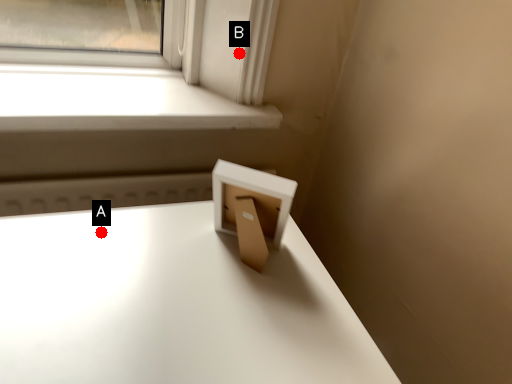
Question: Two points are circled on the image, labeled by A and B beside each circle. Among these points, which one is nearest to the camera?

Choices:
 (A) A is closer
 (B) B is closer

Answer: (A)